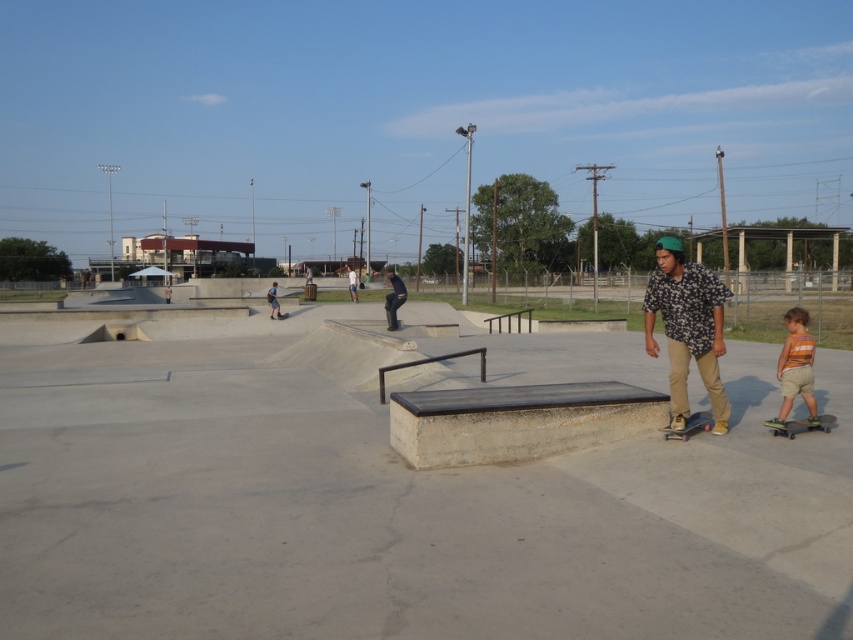
You are a skateboarder looking to grab your board. You see the green rubber skateboard at lower right and the black rubber skateboard at center. Which one is positioned more to the right side of the skatepark?

The green rubber skateboard at lower right is positioned more to the right side of the skatepark as it is located to the right of the black rubber skateboard at center.